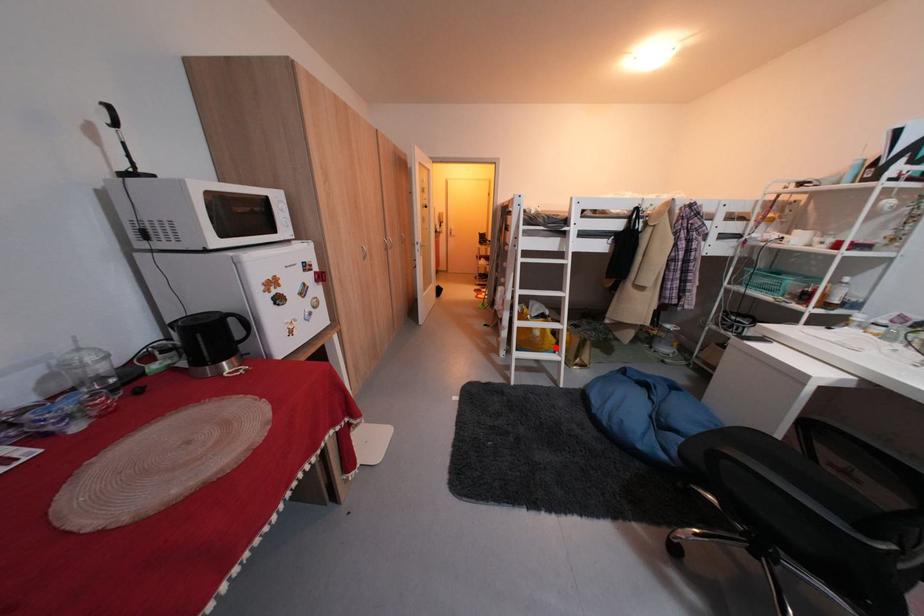
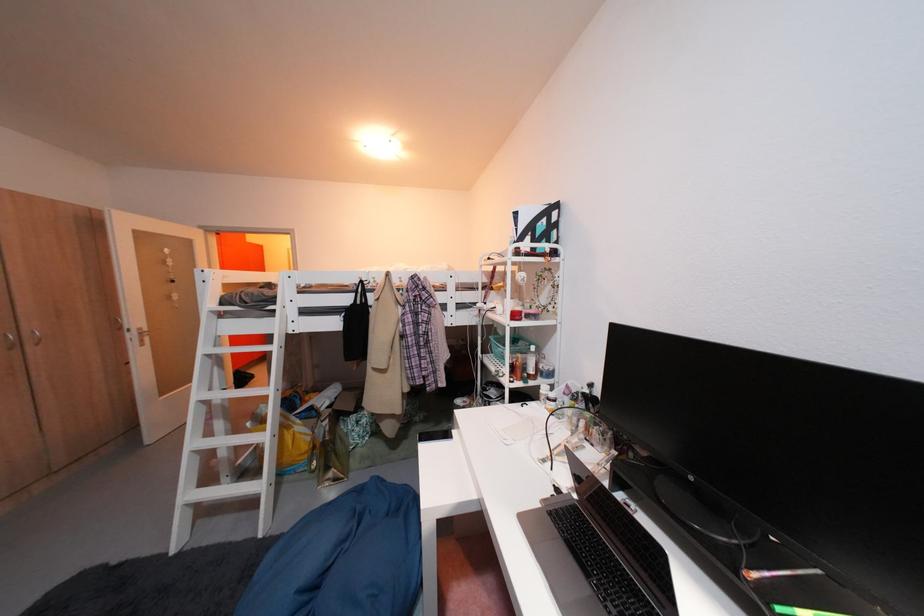
In the second image, find the point that corresponds to the highlighted location in the first image.

(296, 461)